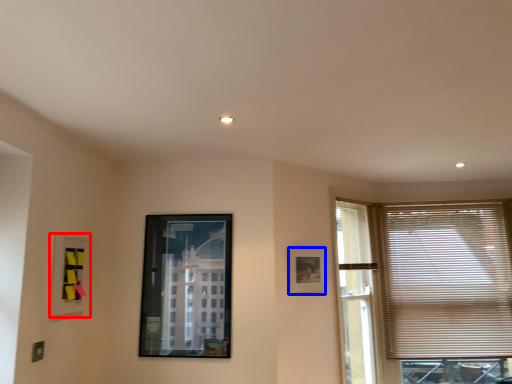
Question: Among these objects, which one is nearest to the camera, picture frame (highlighted by a red box) or picture frame (highlighted by a blue box)?

Choices:
 (A) picture frame
 (B) picture frame

Answer: (A)